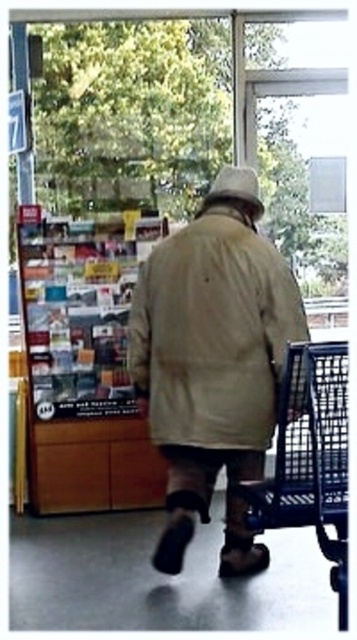
You are a fashion designer observing a person in a store. You notice the khaki cotton jacket at center and the white fabric hat at upper center. Which item would require more fabric to create based on their sizes?

The khaki cotton jacket at center is larger in size than the white fabric hat at upper center, so it would require more fabric to create.

You are a store employee checking the clearance heights at the entrance. The entrance has a height restriction of 1.5 meters. Given the metallic blue shopping cart at right and the white fabric hat at upper center, which object is more likely to exceed the height limit?

The metallic blue shopping cart at right is taller than the white fabric hat at upper center. Since the entrance has a height restriction of 1.5 meters, the metallic blue shopping cart at right is more likely to exceed the height limit if its height surpasses 1.5 meters.